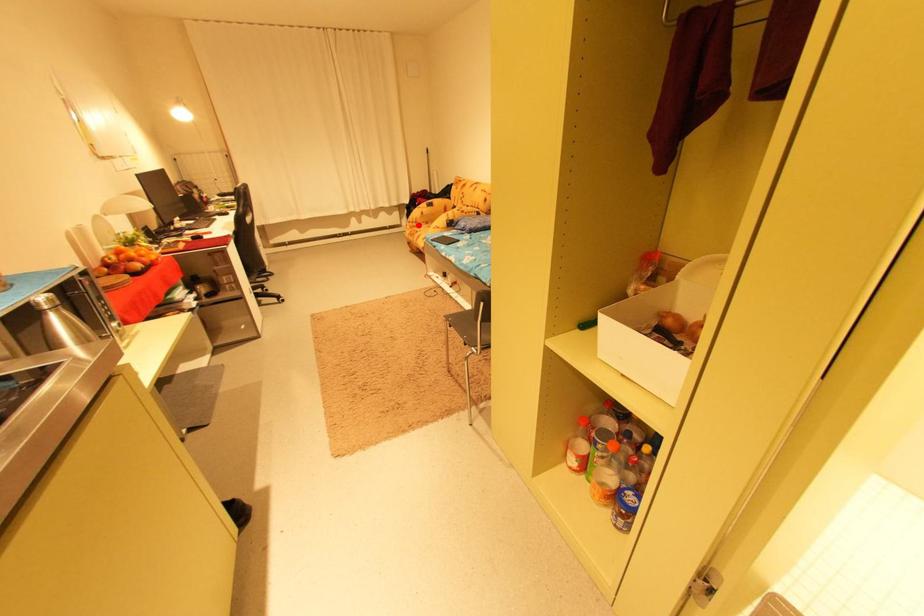
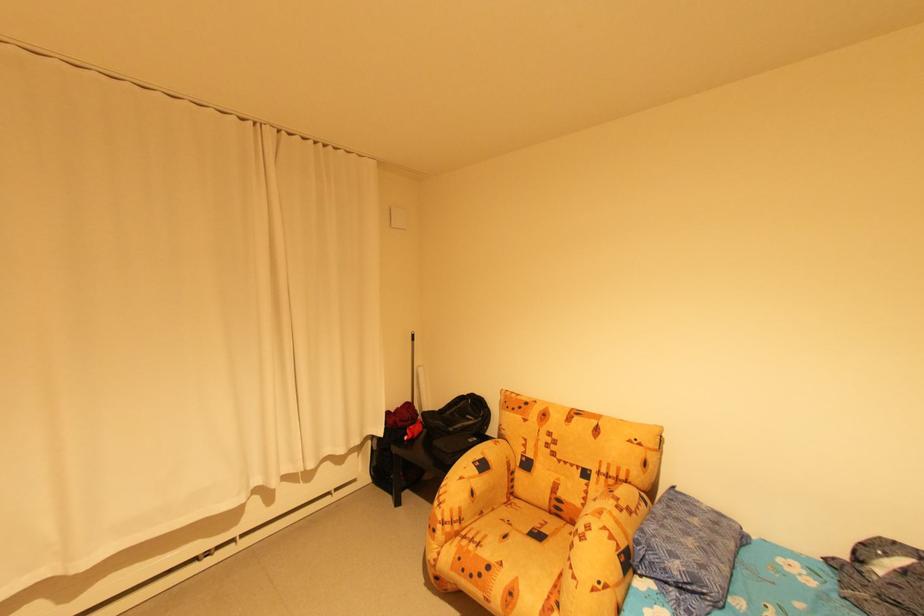
The point at the highlighted location is marked in the first image. Where is the corresponding point in the second image?

(456, 529)